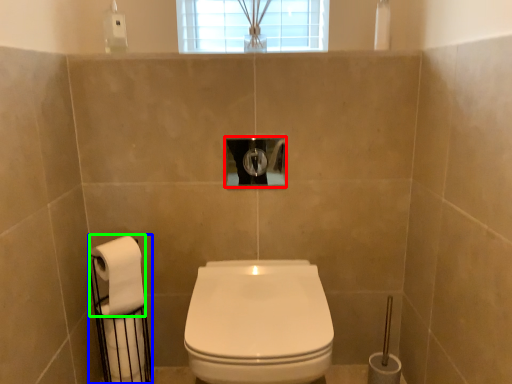
Question: Based on their relative distances, which object is nearer to hole (highlighted by a red box)? Choose from toilet paper (highlighted by a blue box) and toilet paper (highlighted by a green box).

Choices:
 (A) toilet paper
 (B) toilet paper

Answer: (B)